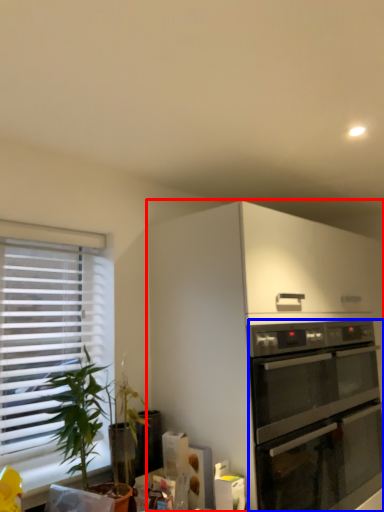
Question: Among these objects, which one is nearest to the camera, cabinetry (highlighted by a red box) or oven (highlighted by a blue box)?

Choices:
 (A) cabinetry
 (B) oven

Answer: (A)